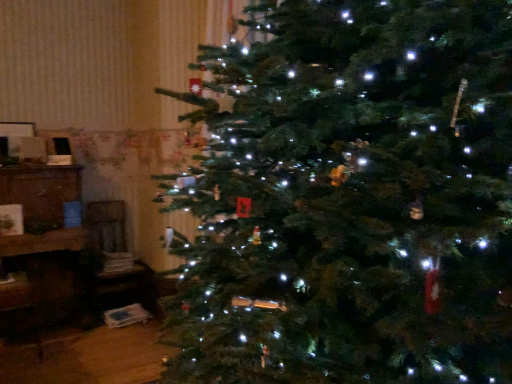
Question: Does wooden chair at left have a lesser height compared to green matte christmas tree at center?

Choices:
 (A) yes
 (B) no

Answer: (A)

Question: Is wooden chair at left facing towards green matte christmas tree at center?

Choices:
 (A) yes
 (B) no

Answer: (B)

Question: Does wooden chair at left have a greater height compared to green matte christmas tree at center?

Choices:
 (A) no
 (B) yes

Answer: (A)

Question: Are wooden chair at left and green matte christmas tree at center far apart?

Choices:
 (A) yes
 (B) no

Answer: (A)

Question: Does wooden chair at left have a smaller size compared to green matte christmas tree at center?

Choices:
 (A) yes
 (B) no

Answer: (A)

Question: Does wooden chair at left come in front of green matte christmas tree at center?

Choices:
 (A) yes
 (B) no

Answer: (B)

Question: Does brown wooden cabinet at left have a smaller size compared to green matte christmas tree at center?

Choices:
 (A) no
 (B) yes

Answer: (B)

Question: From a real-world perspective, is brown wooden cabinet at left physically above green matte christmas tree at center?

Choices:
 (A) yes
 (B) no

Answer: (B)

Question: Can you confirm if brown wooden cabinet at left is taller than green matte christmas tree at center?

Choices:
 (A) no
 (B) yes

Answer: (A)

Question: Is brown wooden cabinet at left further to camera compared to green matte christmas tree at center?

Choices:
 (A) no
 (B) yes

Answer: (A)

Question: From a real-world perspective, is brown wooden cabinet at left beneath green matte christmas tree at center?

Choices:
 (A) yes
 (B) no

Answer: (A)

Question: Is brown wooden cabinet at left positioned far away from green matte christmas tree at center?

Choices:
 (A) yes
 (B) no

Answer: (A)

Question: From the image's perspective, would you say green matte christmas tree at center is positioned over brown wooden cabinet at left?

Choices:
 (A) no
 (B) yes

Answer: (B)